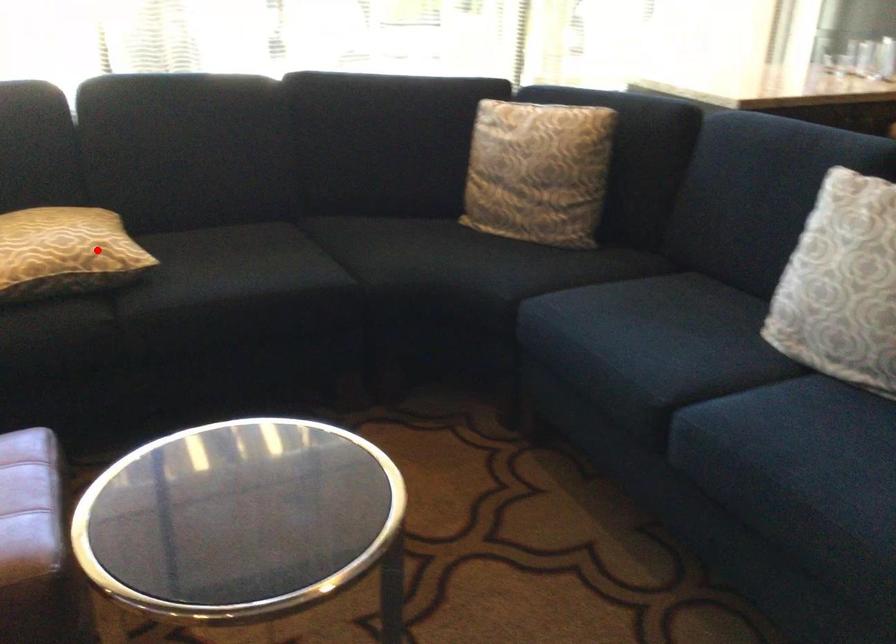
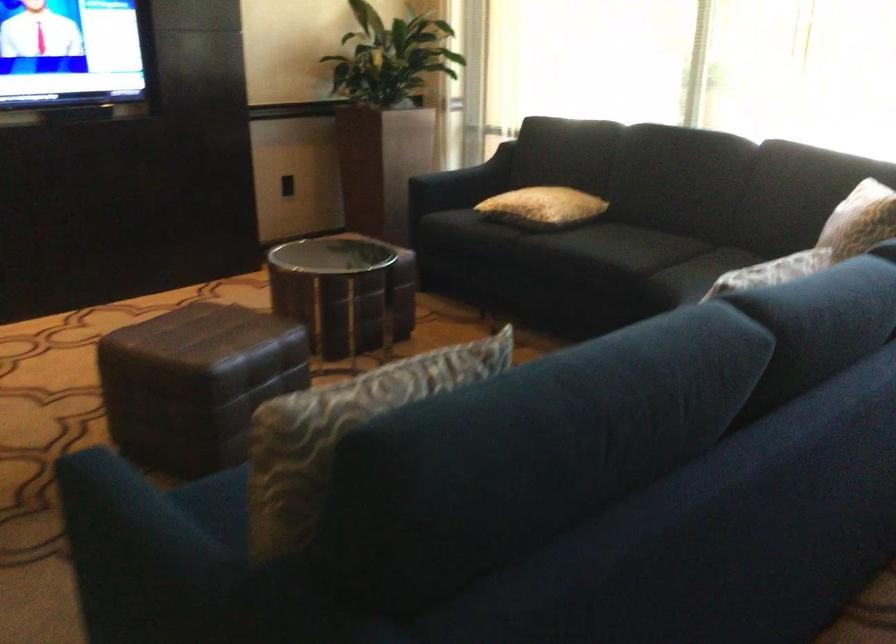
Question: I am providing you with two images of the same scene from different viewpoints. Given a red point in image1, look at the same physical point in image2. Is it:

Choices:
 (A) Closer to the viewpoint
 (B) Farther from the viewpoint

Answer: (B)